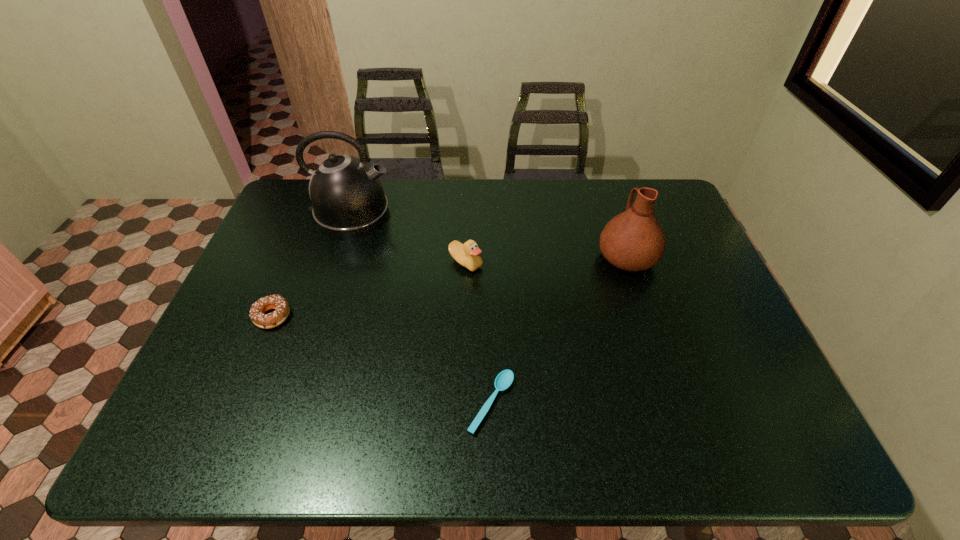
At what (x,y) coordinates should I click in order to perform the action: click on empty space between the rightmost object and the tallest object. Please return your answer as a coordinate pair (x, y). Image resolution: width=960 pixels, height=540 pixels. Looking at the image, I should click on (489, 235).

Find the location of a particular element. vacant space that is in between the third shortest object and the doughnut is located at coordinates (369, 289).

Identify the location of free space between the pitcher and the nearest object. Image resolution: width=960 pixels, height=540 pixels. (559, 330).

You are a GUI agent. You are given a task and a screenshot of the screen. Output one action in this format:
    pyautogui.click(x=<x>, y=<y>)
    Task: Click on the free space between the second nearest object and the tallest object
    The width and height of the screenshot is (960, 540).
    Given the screenshot: What is the action you would take?
    pyautogui.click(x=312, y=265)

You are a GUI agent. You are given a task and a screenshot of the screen. Output one action in this format:
    pyautogui.click(x=<x>, y=<y>)
    Task: Click on the free space between the duck and the second tallest object
    This screenshot has height=540, width=960.
    Given the screenshot: What is the action you would take?
    pyautogui.click(x=546, y=260)

This screenshot has height=540, width=960. Identify the location of free area in between the pitcher and the doughnut. (449, 287).

Identify the location of free point between the pitcher and the shortest object. This screenshot has height=540, width=960. (559, 330).

Identify which object is located as the fourth nearest to the fourth tallest object. Please provide its 2D coordinates. Your answer should be formatted as a tuple, i.e. [(x, y)], where the tuple contains the x and y coordinates of a point satisfying the conditions above.

[(633, 240)]

Image resolution: width=960 pixels, height=540 pixels. Identify the location of object that ranks as the third closest to the fourth tallest object. (504, 379).

Find the location of `vacant space that satisfies the following two spatial constraints: 1. on the front side of the fourth farthest object; 2. on the left side of the shortest object`. vacant space that satisfies the following two spatial constraints: 1. on the front side of the fourth farthest object; 2. on the left side of the shortest object is located at coordinates (236, 403).